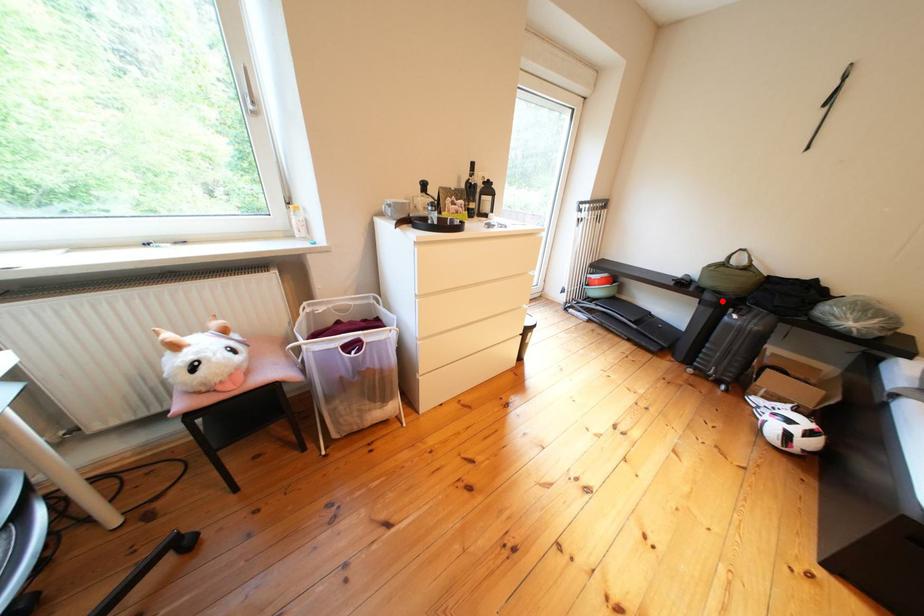
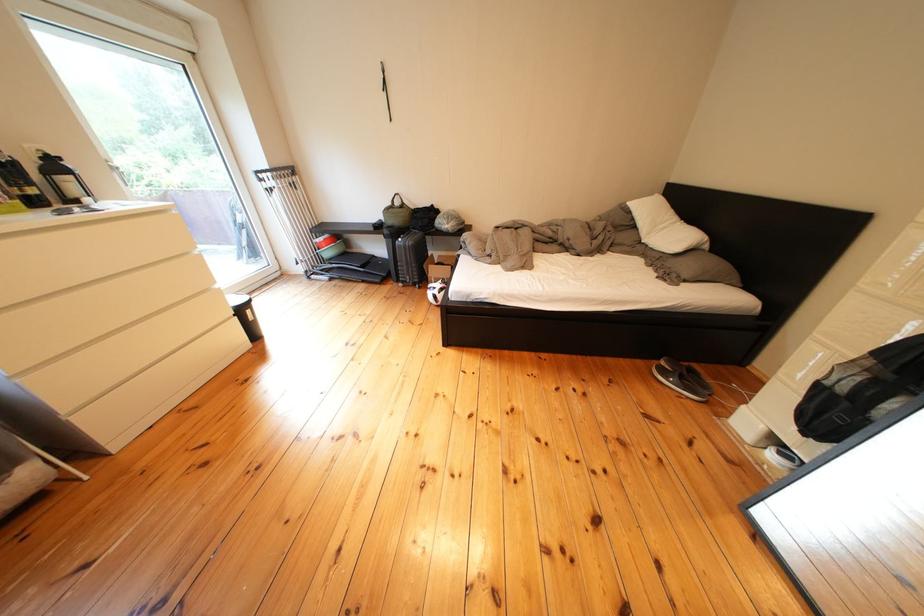
The point at the highlighted location is marked in the first image. Where is the corresponding point in the second image?

(399, 236)